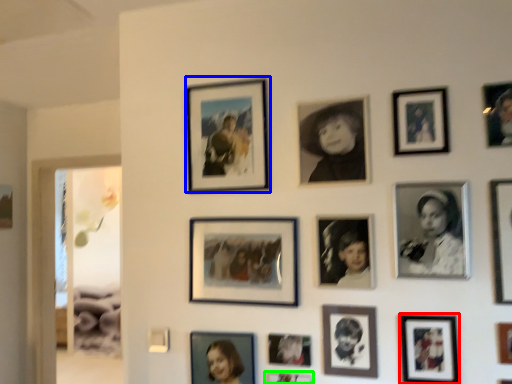
Question: Based on their relative distances, which object is nearer to picture frame (highlighted by a red box)? Choose from picture frame (highlighted by a blue box) and picture frame (highlighted by a green box).

Choices:
 (A) picture frame
 (B) picture frame

Answer: (B)